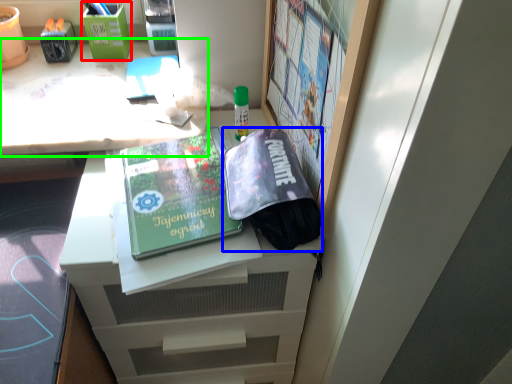
Question: Based on their relative distances, which object is nearer to stationery (highlighted by a red box)? Choose from bag (highlighted by a blue box) and desk (highlighted by a green box).

Choices:
 (A) bag
 (B) desk

Answer: (B)